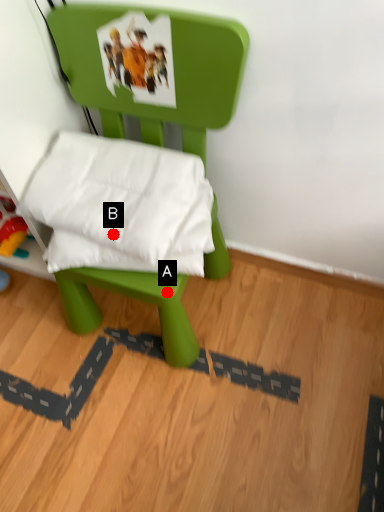
Question: Two points are circled on the image, labeled by A and B beside each circle. Which point appears closest to the camera in this image?

Choices:
 (A) A is closer
 (B) B is closer

Answer: (B)